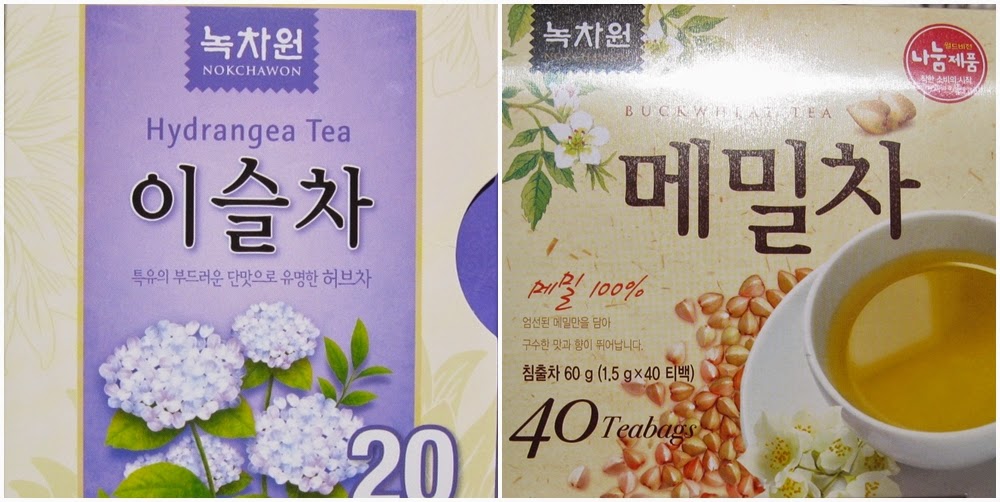
What are the coordinates of `tea box` in the screenshot? It's located at (440, 86), (804, 55).